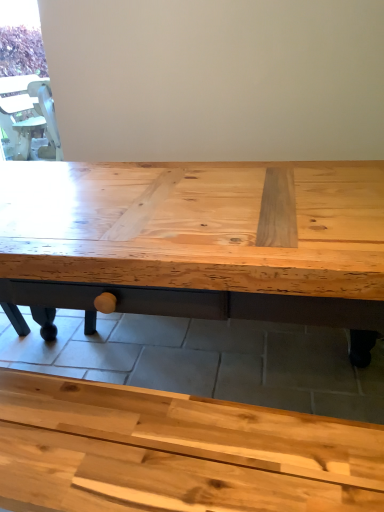
I want to click on free spot above natural wood table at center (from a real-world perspective), so click(183, 360).